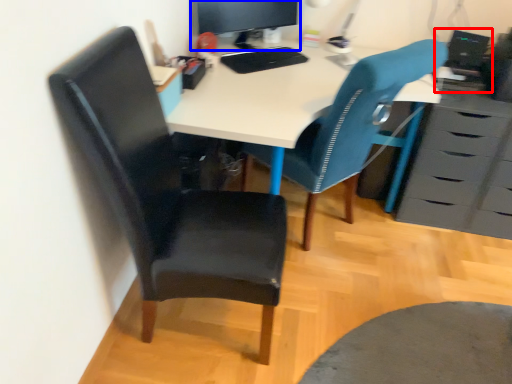
Question: Which point is further to the camera, computer (highlighted by a red box) or computer monitor (highlighted by a blue box)?

Choices:
 (A) computer
 (B) computer monitor

Answer: (A)